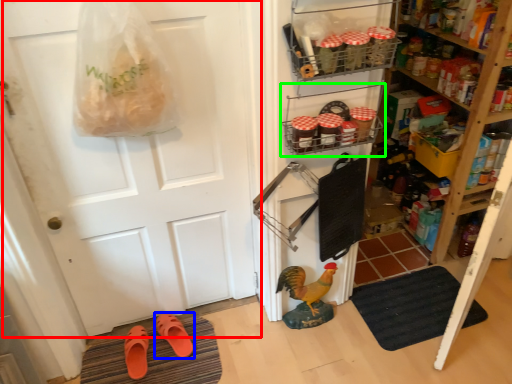
Question: Estimate the real-world distances between objects in this image. Which object is closer to door (highlighted by a red box), footwear (highlighted by a blue box) or shelf (highlighted by a green box)?

Choices:
 (A) footwear
 (B) shelf

Answer: (B)